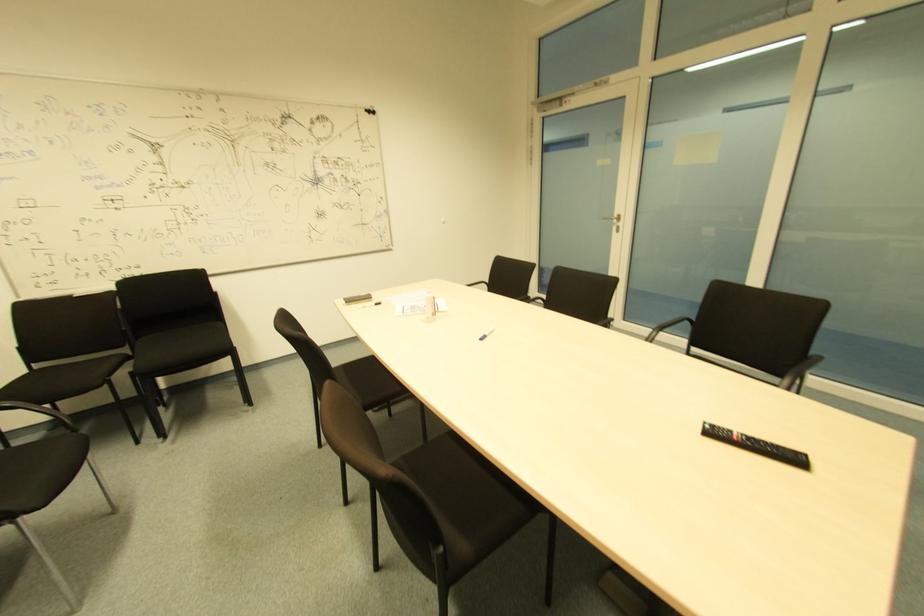
What do you see at coordinates (614, 221) in the screenshot? Image resolution: width=924 pixels, height=616 pixels. I see `the silver door handle` at bounding box center [614, 221].